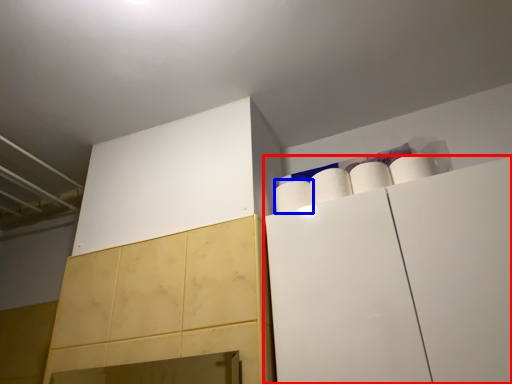
Question: Which point is closer to the camera, cabinetry (highlighted by a red box) or paper towel (highlighted by a blue box)?

Choices:
 (A) cabinetry
 (B) paper towel

Answer: (A)